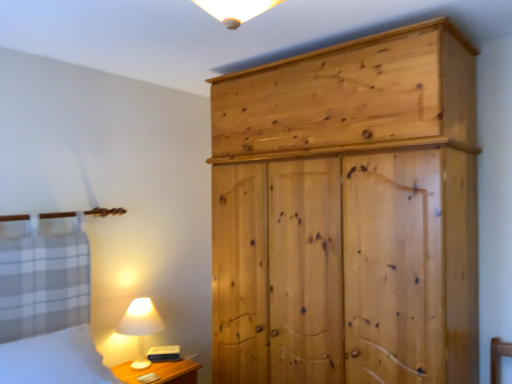
Measure the distance between point [112,369] and camera.

The distance of point [112,369] from camera is 2.56 meters.

Consider the image. Measure the distance between white matte table lamp at lower left and camera.

white matte table lamp at lower left and camera are 8.34 feet apart.

The width and height of the screenshot is (512, 384). What do you see at coordinates (54, 359) in the screenshot?
I see `white cotton bed at lower left` at bounding box center [54, 359].

What do you see at coordinates (348, 214) in the screenshot?
I see `natural wood wardrobe at right` at bounding box center [348, 214].

Image resolution: width=512 pixels, height=384 pixels. What are the coordinates of `wooden nightstand at lower left` in the screenshot? It's located at (160, 372).

Is wooden nightstand at lower left not within white cotton bed at lower left?

Yes.

From a real-world perspective, which is physically above, wooden nightstand at lower left or white cotton bed at lower left?

white cotton bed at lower left is physically above.

Is white cotton bed at lower left at the back of wooden nightstand at lower left?

No, wooden nightstand at lower left's orientation is not away from white cotton bed at lower left.

From the image's perspective, is white matte table lamp at lower left below white cotton bed at lower left?

Yes, from the image's perspective, white matte table lamp at lower left is below white cotton bed at lower left.

Looking at this image, from a real-world perspective, is white matte table lamp at lower left positioned above or below white cotton bed at lower left?

Clearly, from a real-world perspective, white matte table lamp at lower left is below white cotton bed at lower left.

Is white matte table lamp at lower left facing away from white cotton bed at lower left?

That's not correct — white matte table lamp at lower left is not looking away from white cotton bed at lower left.

Does wooden nightstand at lower left appear on the left side of natural wood wardrobe at right?

Indeed, wooden nightstand at lower left is positioned on the left side of natural wood wardrobe at right.

Is wooden nightstand at lower left completely or partially outside of natural wood wardrobe at right?

Absolutely, wooden nightstand at lower left is external to natural wood wardrobe at right.

This screenshot has width=512, height=384. Identify the location of cupboard above the wooden nightstand at lower left (from the image's perspective). (348, 214).

Looking at this image, could you tell me if wooden nightstand at lower left is facing natural wood wardrobe at right?

No, wooden nightstand at lower left does not turn towards natural wood wardrobe at right.

Which object is wider, wooden nightstand at lower left or white matte table lamp at lower left?

With larger width is wooden nightstand at lower left.

Consider the image. From a real-world perspective, is wooden nightstand at lower left positioned under white matte table lamp at lower left based on gravity?

Correct, in the physical world, wooden nightstand at lower left is lower than white matte table lamp at lower left.

The image size is (512, 384). Identify the location of table lamp above the wooden nightstand at lower left (from the image's perspective). (140, 326).

Based on the photo, is wooden nightstand at lower left to the right of white matte table lamp at lower left from the viewer's perspective?

Yes, wooden nightstand at lower left is to the right of white matte table lamp at lower left.

From the picture: Considering the relative positions of natural wood wardrobe at right and wooden nightstand at lower left in the image provided, is natural wood wardrobe at right to the left of wooden nightstand at lower left from the viewer's perspective?

No.

Where is `nightstand on the left of natural wood wardrobe at right`? This screenshot has height=384, width=512. nightstand on the left of natural wood wardrobe at right is located at coordinates (160, 372).

Is wooden nightstand at lower left inside natural wood wardrobe at right?

Definitely not — wooden nightstand at lower left is not inside natural wood wardrobe at right.

Based on their positions, is white cotton bed at lower left located to the left or right of natural wood wardrobe at right?

In the image, white cotton bed at lower left appears on the left side of natural wood wardrobe at right.

Is white cotton bed at lower left oriented away from natural wood wardrobe at right?

No.

Considering the sizes of objects white cotton bed at lower left and natural wood wardrobe at right in the image provided, who is shorter, white cotton bed at lower left or natural wood wardrobe at right?

Standing shorter between the two is white cotton bed at lower left.

Is white cotton bed at lower left wider than natural wood wardrobe at right?

Incorrect, the width of white cotton bed at lower left does not surpass that of natural wood wardrobe at right.

In the scene shown: Is natural wood wardrobe at right to the right of white matte table lamp at lower left from the viewer's perspective?

Yes, natural wood wardrobe at right is to the right of white matte table lamp at lower left.

Considering the sizes of objects natural wood wardrobe at right and white matte table lamp at lower left in the image provided, who is bigger, natural wood wardrobe at right or white matte table lamp at lower left?

natural wood wardrobe at right.

Is natural wood wardrobe at right inside the boundaries of white matte table lamp at lower left, or outside?

natural wood wardrobe at right is not enclosed by white matte table lamp at lower left.

From the image's perspective, which one is positioned lower, natural wood wardrobe at right or white matte table lamp at lower left?

→ white matte table lamp at lower left appears lower in the image.

The width and height of the screenshot is (512, 384). I want to click on bedding on the left of wooden nightstand at lower left, so click(x=54, y=359).

This screenshot has height=384, width=512. In order to click on table lamp behind the white cotton bed at lower left in this screenshot , I will do `click(140, 326)`.

Based on their spatial positions, is wooden nightstand at lower left or white matte table lamp at lower left further from natural wood wardrobe at right?

wooden nightstand at lower left is positioned further to the anchor natural wood wardrobe at right.

Based on their spatial positions, is wooden nightstand at lower left or white cotton bed at lower left further from natural wood wardrobe at right?

Based on the image, wooden nightstand at lower left appears to be further to natural wood wardrobe at right.

Which object lies nearer to the anchor point white cotton bed at lower left, wooden nightstand at lower left or white matte table lamp at lower left?

white matte table lamp at lower left is closer to white cotton bed at lower left.

From the image, which object appears to be farther from white cotton bed at lower left, wooden nightstand at lower left or natural wood wardrobe at right?

Among the two, natural wood wardrobe at right is located further to white cotton bed at lower left.

Looking at this image, estimate the real-world distances between objects in this image. Which object is closer to wooden nightstand at lower left, white matte table lamp at lower left or white cotton bed at lower left?

Based on the image, white matte table lamp at lower left appears to be nearer to wooden nightstand at lower left.

Which object lies nearer to the anchor point wooden nightstand at lower left, natural wood wardrobe at right or white matte table lamp at lower left?

white matte table lamp at lower left is closer to wooden nightstand at lower left.

When comparing their distances from white matte table lamp at lower left, does natural wood wardrobe at right or wooden nightstand at lower left seem further?

Among the two, natural wood wardrobe at right is located further to white matte table lamp at lower left.

Estimate the real-world distances between objects in this image. Which object is further from white matte table lamp at lower left, natural wood wardrobe at right or white cotton bed at lower left?

Based on the image, natural wood wardrobe at right appears to be further to white matte table lamp at lower left.

You are a GUI agent. You are given a task and a screenshot of the screen. Output one action in this format:
    pyautogui.click(x=<x>, y=<y>)
    Task: Click on the nightstand located between white cotton bed at lower left and natural wood wardrobe at right in the left-right direction
    This screenshot has width=512, height=384.
    Given the screenshot: What is the action you would take?
    pyautogui.click(x=160, y=372)

I want to click on table lamp located between white cotton bed at lower left and natural wood wardrobe at right in the left-right direction, so click(x=140, y=326).

This screenshot has width=512, height=384. What are the coordinates of `nightstand located between white cotton bed at lower left and white matte table lamp at lower left in the depth direction` in the screenshot? It's located at (160, 372).

Find the location of `nightstand situated between white matte table lamp at lower left and natural wood wardrobe at right from left to right`. nightstand situated between white matte table lamp at lower left and natural wood wardrobe at right from left to right is located at coordinates (160, 372).